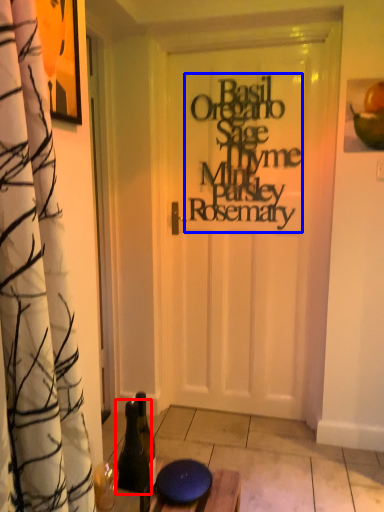
Question: Which object appears farthest to the camera in this image, bottle (highlighted by a red box) or writing (highlighted by a blue box)?

Choices:
 (A) bottle
 (B) writing

Answer: (B)